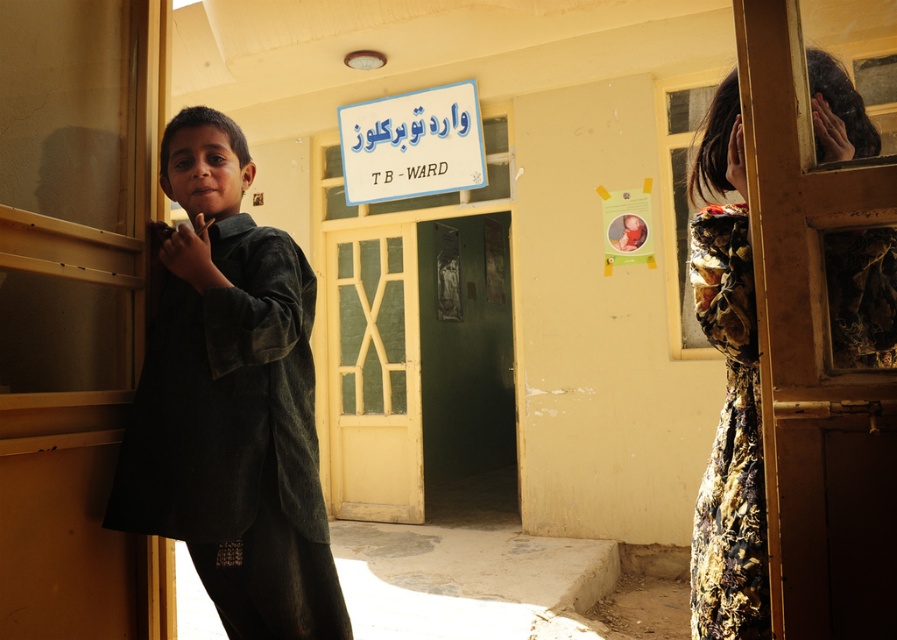
Is white plastic sign at upper center below white plastic sign at center?

No, white plastic sign at upper center is not below white plastic sign at center.

Who is positioned more to the left, white plastic sign at upper center or white plastic sign at center?

white plastic sign at upper center

Does point (430, 172) come closer to viewer compared to point (433, 176)?

No, it is behind (433, 176).

You are a GUI agent. You are given a task and a screenshot of the screen. Output one action in this format:
    pyautogui.click(x=<x>, y=<y>)
    Task: Click on the white plastic sign at upper center
    
    Given the screenshot: What is the action you would take?
    pyautogui.click(x=412, y=145)

In the scene shown: Which of these two, dark green fabric at center or floral dress at right, stands taller?

With more height is dark green fabric at center.

Is dark green fabric at center taller than floral dress at right?

Indeed, dark green fabric at center has a greater height compared to floral dress at right.

Does point (194, 200) come in front of point (730, 342)?

No, it is behind (730, 342).

Locate an element on the screen. The height and width of the screenshot is (640, 897). dark green fabric at center is located at coordinates (231, 401).

Which is above, floral dress at right or white plastic sign at center?

white plastic sign at center

Looking at this image, is the position of floral dress at right less distant than that of white plastic sign at center?

Yes, floral dress at right is in front of white plastic sign at center.

Looking at this image, who is more distant from viewer, (762, 561) or (396, 168)?

The point (396, 168) is behind.

The width and height of the screenshot is (897, 640). In order to click on floral dress at right in this screenshot , I will do `click(728, 392)`.